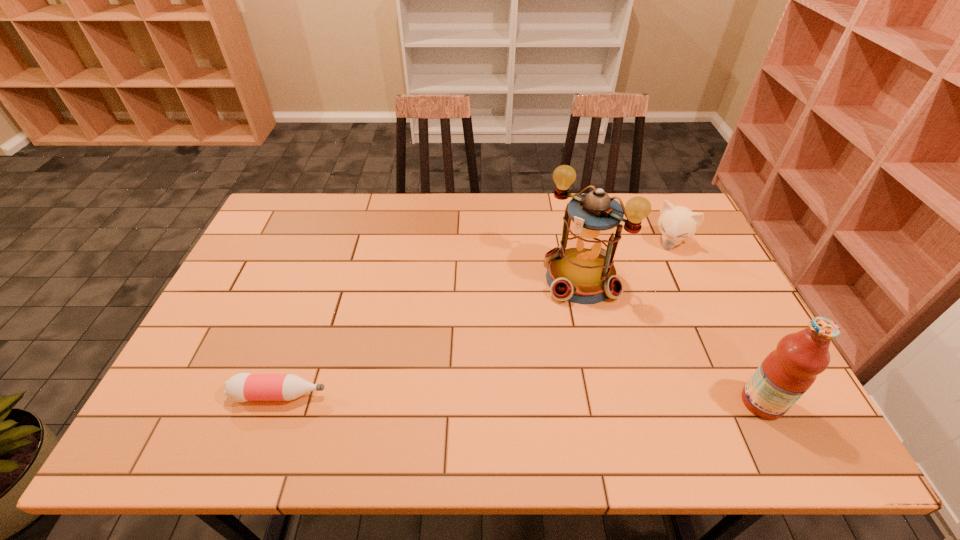
You are a GUI agent. You are given a task and a screenshot of the screen. Output one action in this format:
    pyautogui.click(x=<x>, y=<y>)
    Task: Click on the free space on the desktop that is between the bottle and the third shortest object and is positioned on the front-facing side of the tallest object
    
    Given the screenshot: What is the action you would take?
    pyautogui.click(x=454, y=397)

Where is `vacant space on the desktop that is between the bottle and the fruit juice and is positioned on the face of the third tallest object`? Image resolution: width=960 pixels, height=540 pixels. vacant space on the desktop that is between the bottle and the fruit juice and is positioned on the face of the third tallest object is located at coordinates (566, 399).